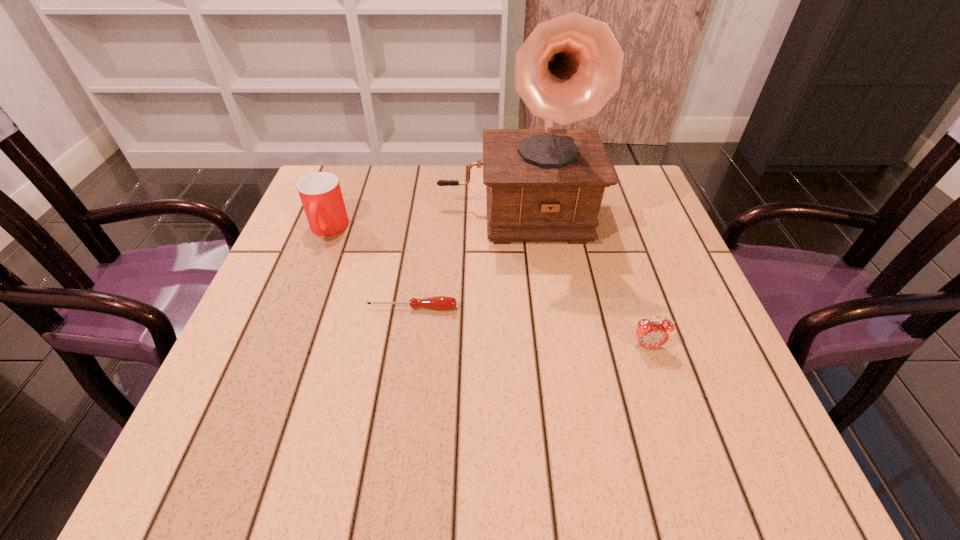
Find the location of `vacant region at the far left corner of the desktop`. vacant region at the far left corner of the desktop is located at coordinates (368, 192).

What are the coordinates of `free region at the near left corner of the desktop` in the screenshot? It's located at (272, 434).

Image resolution: width=960 pixels, height=540 pixels. In order to click on free point at the far right corner in this screenshot , I will do `click(632, 188)`.

Image resolution: width=960 pixels, height=540 pixels. Identify the location of free space between the record player and the third tallest object. (581, 278).

Image resolution: width=960 pixels, height=540 pixels. In order to click on empty space between the leftmost object and the third farthest object in this screenshot , I will do pyautogui.click(x=370, y=268).

Find the location of a particular element. This screenshot has width=960, height=540. unoccupied position between the tallest object and the cup is located at coordinates (420, 219).

At what (x,y) coordinates should I click in order to perform the action: click on free space between the third shortest object and the screwdriver. Please return your answer as a coordinate pair (x, y). The height and width of the screenshot is (540, 960). Looking at the image, I should click on (370, 268).

Where is `blank region between the leftmost object and the record player`? Image resolution: width=960 pixels, height=540 pixels. blank region between the leftmost object and the record player is located at coordinates click(x=420, y=219).

This screenshot has width=960, height=540. I want to click on vacant region between the cup and the shortest object, so click(370, 268).

The height and width of the screenshot is (540, 960). Find the location of `blank region between the shortest object and the tallest object`. blank region between the shortest object and the tallest object is located at coordinates (463, 258).